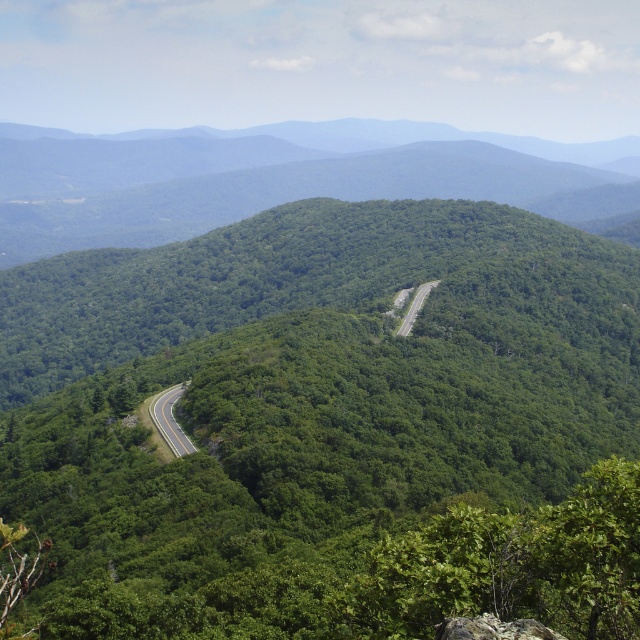
Question: Which point is closer to the camera?

Choices:
 (A) (426, 289)
 (B) (154, 413)

Answer: (B)

Question: Is smooth asphalt road at center below green asphalt road at center?

Choices:
 (A) yes
 (B) no

Answer: (A)

Question: Does smooth asphalt road at center come in front of green asphalt road at center?

Choices:
 (A) yes
 (B) no

Answer: (A)

Question: Can you confirm if smooth asphalt road at center is positioned below green asphalt road at center?

Choices:
 (A) yes
 (B) no

Answer: (A)

Question: Which object appears closest to the camera in this image?

Choices:
 (A) smooth asphalt road at center
 (B) green asphalt road at center

Answer: (A)

Question: Which object is closer to the camera taking this photo?

Choices:
 (A) green asphalt road at center
 (B) smooth asphalt road at center

Answer: (B)